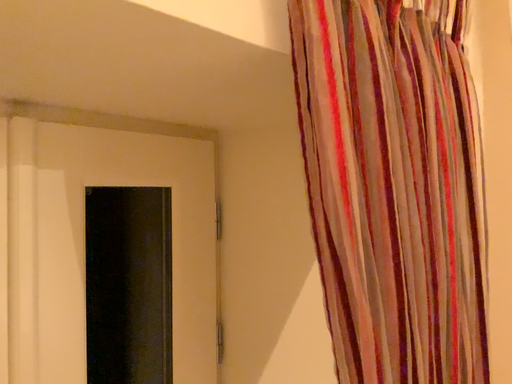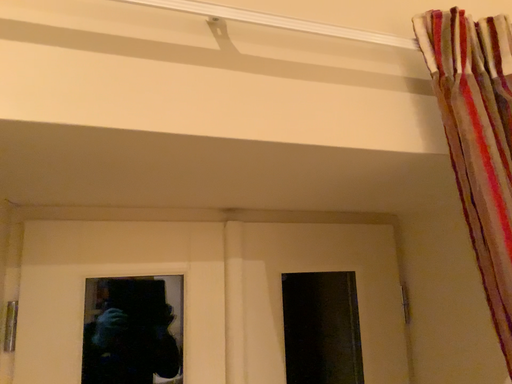
Question: How did the camera likely rotate when shooting the video?

Choices:
 (A) rotated upward
 (B) rotated downward

Answer: (A)